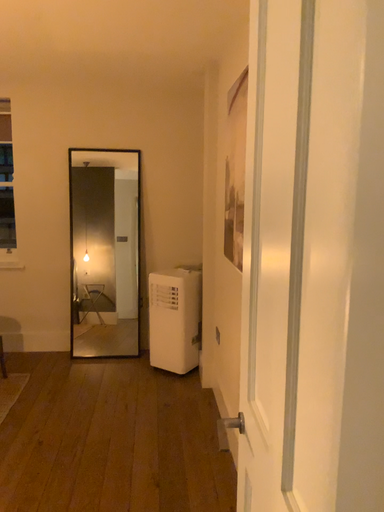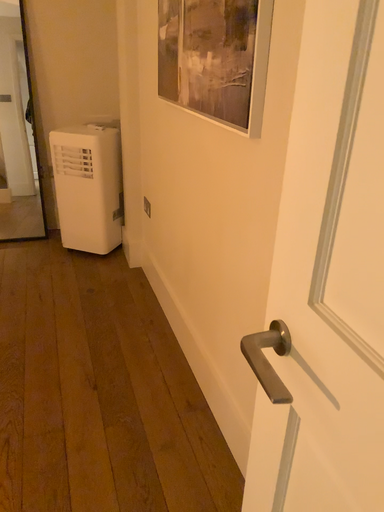
Question: How did the camera likely rotate when shooting the video?

Choices:
 (A) rotated upward
 (B) rotated downward

Answer: (B)